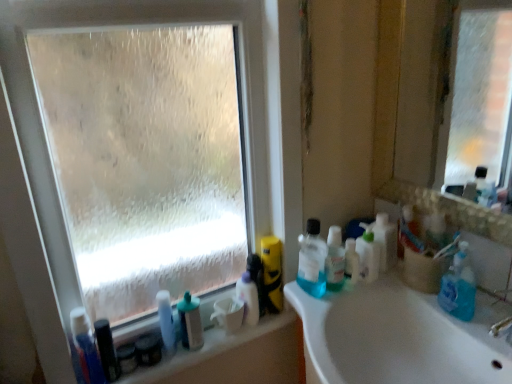
Question: Does white glossy spray bottle at lower center, arranged as the third toiletry when viewed from the right, appear on the left side of translucent plastic bottles at right, the fourth cleaning product in the left-to-right sequence?

Choices:
 (A) yes
 (B) no

Answer: (A)

Question: Can you confirm if white glossy spray bottle at lower center, acting as the fifth toiletry starting from the left, is shorter than translucent plastic bottles at right, the fourth cleaning product in the left-to-right sequence?

Choices:
 (A) no
 (B) yes

Answer: (B)

Question: Is white glossy spray bottle at lower center, acting as the fifth toiletry starting from the left, far away from translucent plastic bottles at right, the fourth cleaning product in the left-to-right sequence?

Choices:
 (A) yes
 (B) no

Answer: (B)

Question: Is white glossy spray bottle at lower center, acting as the fifth toiletry starting from the left, directly adjacent to translucent plastic bottles at right, the fourth cleaning product in the left-to-right sequence?

Choices:
 (A) no
 (B) yes

Answer: (A)

Question: Considering the relative sizes of white glossy spray bottle at lower center, acting as the fifth toiletry starting from the left, and translucent plastic bottles at right, acting as the second cleaning product starting from the right, in the image provided, is white glossy spray bottle at lower center, acting as the fifth toiletry starting from the left, wider than translucent plastic bottles at right, acting as the second cleaning product starting from the right,?

Choices:
 (A) yes
 (B) no

Answer: (A)

Question: From a real-world perspective, is white glossy spray bottle at lower center, acting as the fifth toiletry starting from the left, positioned over translucent plastic bottles at right, the fourth cleaning product in the left-to-right sequence, based on gravity?

Choices:
 (A) no
 (B) yes

Answer: (A)

Question: Considering the relative positions of transparent frosted glass at upper left and blue translucent liquid at right, arranged as the 3th cleaning product when viewed from the right, in the image provided, is transparent frosted glass at upper left to the left of blue translucent liquid at right, arranged as the 3th cleaning product when viewed from the right, from the viewer's perspective?

Choices:
 (A) no
 (B) yes

Answer: (B)

Question: Can you confirm if transparent frosted glass at upper left is shorter than blue translucent liquid at right, the 3th cleaning product positioned from the left?

Choices:
 (A) no
 (B) yes

Answer: (A)

Question: Is there a large distance between transparent frosted glass at upper left and blue translucent liquid at right, arranged as the 3th cleaning product when viewed from the right?

Choices:
 (A) yes
 (B) no

Answer: (B)

Question: Is blue translucent liquid at right, arranged as the 3th cleaning product when viewed from the right, at the back of transparent frosted glass at upper left?

Choices:
 (A) yes
 (B) no

Answer: (B)

Question: Does transparent frosted glass at upper left have a lesser width compared to blue translucent liquid at right, arranged as the 3th cleaning product when viewed from the right?

Choices:
 (A) yes
 (B) no

Answer: (B)

Question: Is transparent frosted glass at upper left facing towards blue translucent liquid at right, the 3th cleaning product positioned from the left?

Choices:
 (A) yes
 (B) no

Answer: (A)

Question: Is white glossy sink at center in front of transparent frosted glass at upper left?

Choices:
 (A) yes
 (B) no

Answer: (A)